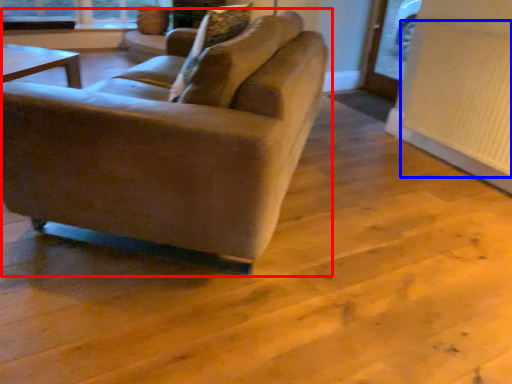
Question: Among these objects, which one is nearest to the camera, studio couch (highlighted by a red box) or radiator (highlighted by a blue box)?

Choices:
 (A) studio couch
 (B) radiator

Answer: (A)